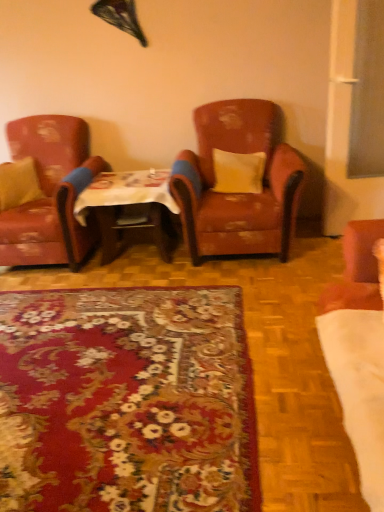
Question: Can you confirm if yellow fabric pillow at center, which is the first pillow in right-to-left order, is wider than floral carpet at center?

Choices:
 (A) yes
 (B) no

Answer: (B)

Question: Can you confirm if yellow fabric pillow at center, which is the first pillow in right-to-left order, is smaller than floral carpet at center?

Choices:
 (A) no
 (B) yes

Answer: (B)

Question: Can you confirm if yellow fabric pillow at center, which is counted as the 2th pillow, starting from the left, is positioned to the right of floral carpet at center?

Choices:
 (A) yes
 (B) no

Answer: (A)

Question: From the image's perspective, is yellow fabric pillow at center, which is the first pillow in right-to-left order, over floral carpet at center?

Choices:
 (A) no
 (B) yes

Answer: (B)

Question: Considering the relative sizes of yellow fabric pillow at center, which is the first pillow in right-to-left order, and floral carpet at center in the image provided, is yellow fabric pillow at center, which is the first pillow in right-to-left order, taller than floral carpet at center?

Choices:
 (A) yes
 (B) no

Answer: (A)

Question: Is yellow fabric pillow at center, which is counted as the 2th pillow, starting from the left, next to floral carpet at center and touching it?

Choices:
 (A) yes
 (B) no

Answer: (B)

Question: Is matte yellow pillow at left, the 2th pillow in the right-to-left sequence, thinner than leather armchair at left, marked as the first chair in a left-to-right arrangement?

Choices:
 (A) no
 (B) yes

Answer: (B)

Question: Is matte yellow pillow at left, the 2th pillow in the right-to-left sequence, at the right side of leather armchair at left, the second chair when ordered from right to left?

Choices:
 (A) no
 (B) yes

Answer: (A)

Question: Is matte yellow pillow at left, the 2th pillow in the right-to-left sequence, not within leather armchair at left, marked as the first chair in a left-to-right arrangement?

Choices:
 (A) yes
 (B) no

Answer: (B)

Question: Is matte yellow pillow at left, positioned as the first pillow in left-to-right order, positioned before leather armchair at left, marked as the first chair in a left-to-right arrangement?

Choices:
 (A) yes
 (B) no

Answer: (B)

Question: Is leather armchair at left, marked as the first chair in a left-to-right arrangement, a part of matte yellow pillow at left, positioned as the first pillow in left-to-right order?

Choices:
 (A) yes
 (B) no

Answer: (B)

Question: From a real-world perspective, does matte yellow pillow at left, the 2th pillow in the right-to-left sequence, stand above leather armchair at left, marked as the first chair in a left-to-right arrangement?

Choices:
 (A) yes
 (B) no

Answer: (A)

Question: Considering the relative sizes of wooden table at center and yellow fabric pillow at center, which is the first pillow in right-to-left order, in the image provided, is wooden table at center bigger than yellow fabric pillow at center, which is the first pillow in right-to-left order,?

Choices:
 (A) yes
 (B) no

Answer: (A)